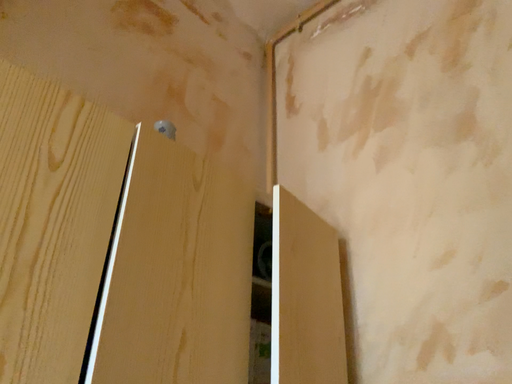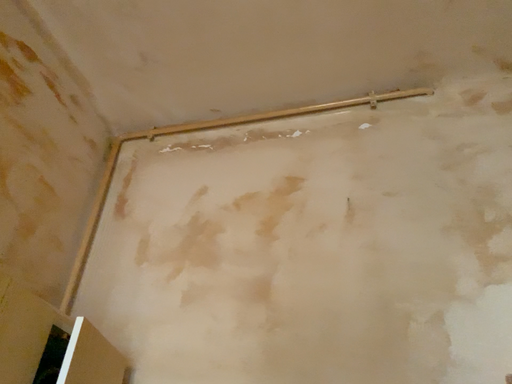
Question: How did the camera likely rotate when shooting the video?

Choices:
 (A) rotated left
 (B) rotated right

Answer: (B)